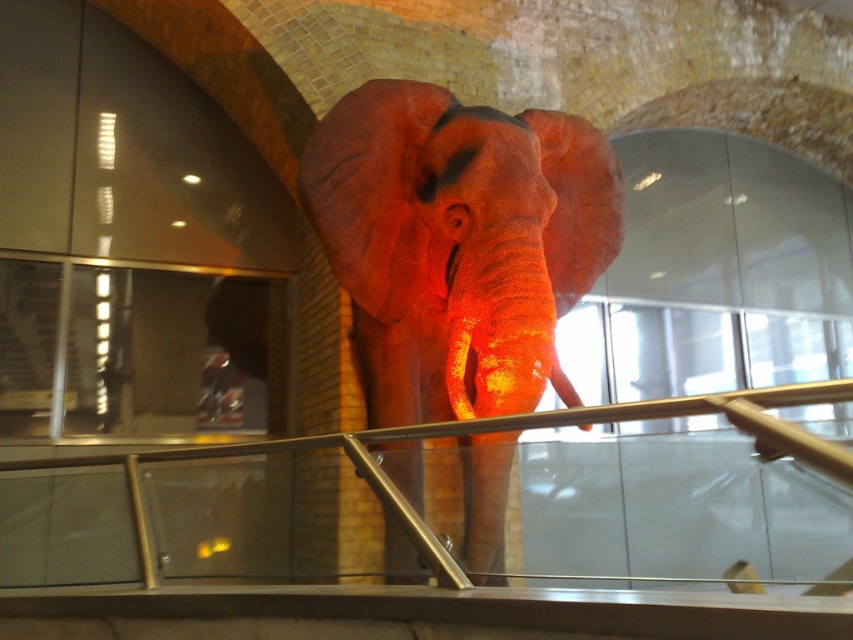
Question: Which of the following is the farthest from the observer?

Choices:
 (A) matte orange tusk at center
 (B) shiny orange elephant at center

Answer: (A)

Question: Among these objects, which one is farthest from the camera?

Choices:
 (A) matte orange tusk at center
 (B) shiny orange elephant at center

Answer: (A)

Question: Does shiny orange elephant at center have a greater width compared to matte orange tusk at center?

Choices:
 (A) yes
 (B) no

Answer: (A)

Question: Is shiny orange elephant at center smaller than matte orange tusk at center?

Choices:
 (A) yes
 (B) no

Answer: (B)

Question: Is shiny orange elephant at center to the left of matte orange tusk at center from the viewer's perspective?

Choices:
 (A) yes
 (B) no

Answer: (A)